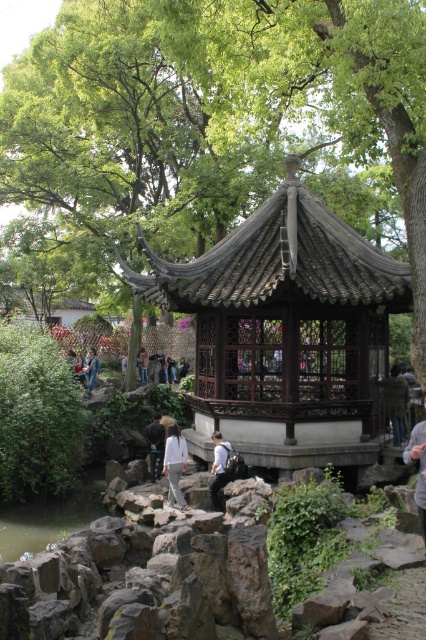
Does point (382, 378) come farther from viewer compared to point (213, 493)?

That is True.

Who is lower down, dark gray fabric jacket at center or white fabric shirt at center?

white fabric shirt at center is lower down.

Does point (393, 396) come behind point (222, 467)?

Yes.

You are a GUI agent. You are given a task and a screenshot of the screen. Output one action in this format:
    pyautogui.click(x=<x>, y=<y>)
    Task: Click on the dark gray fabric jacket at center
    
    Given the screenshot: What is the action you would take?
    pyautogui.click(x=394, y=401)

Is point (86, 470) positioned in front of point (146, 369)?

Yes, point (86, 470) is closer to viewer.

At what (x,y) coordinates should I click in order to perform the action: click on green liquid water at lower left. Please return your answer as a coordinate pair (x, y). The image size is (426, 640). Looking at the image, I should click on (49, 516).

Where is `green liquid water at lower left`? Image resolution: width=426 pixels, height=640 pixels. green liquid water at lower left is located at coordinates (49, 516).

Find the location of a particular element. The width and height of the screenshot is (426, 640). green liquid water at lower left is located at coordinates (49, 516).

Which is above, white fabric at center or white cotton shirt at center?

white cotton shirt at center

Is point (158, 413) positioned behind point (138, 362)?

That is False.

Identify the location of white fabric at center. (155, 444).